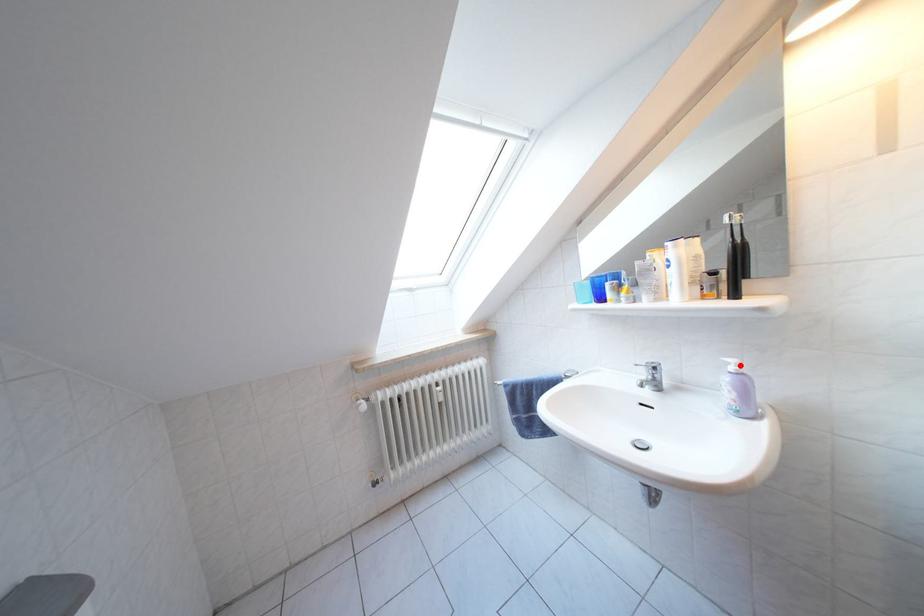
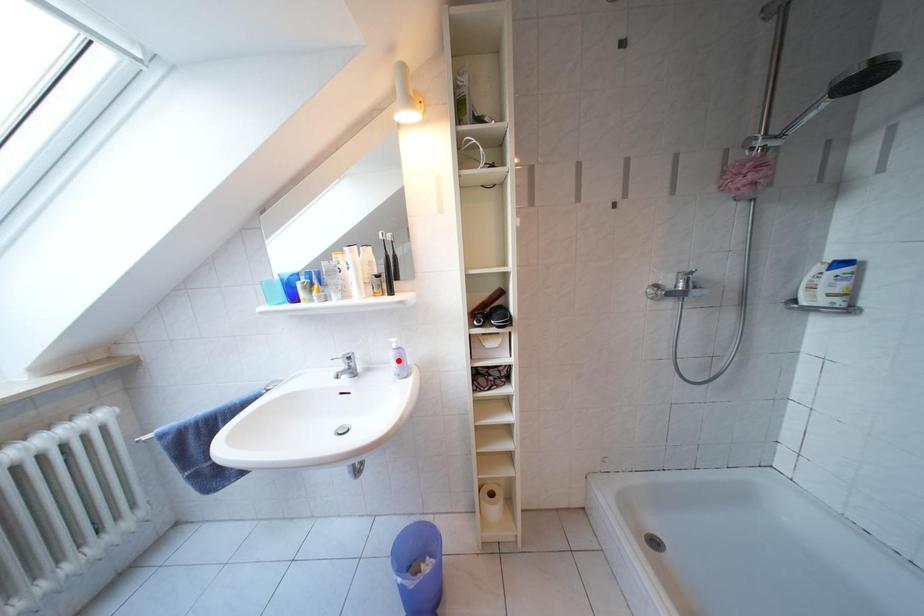
I am providing you with two images of the same scene from different viewpoints. A red point is marked on the first image and another point is marked on the second image. Do the highlighted points in image1 and image2 indicate the same real-world spot?

No